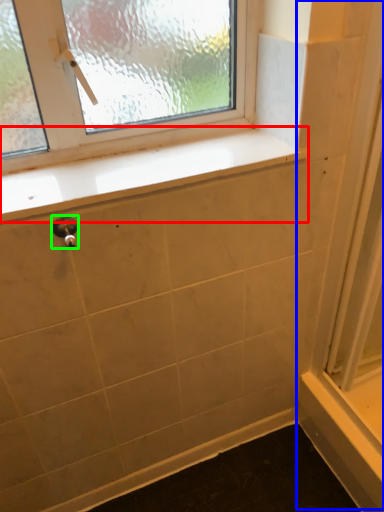
Question: Which object is the closest to the window sill (highlighted by a red box)? Choose among these: screen door (highlighted by a blue box) or door handle (highlighted by a green box).

Choices:
 (A) screen door
 (B) door handle

Answer: (B)